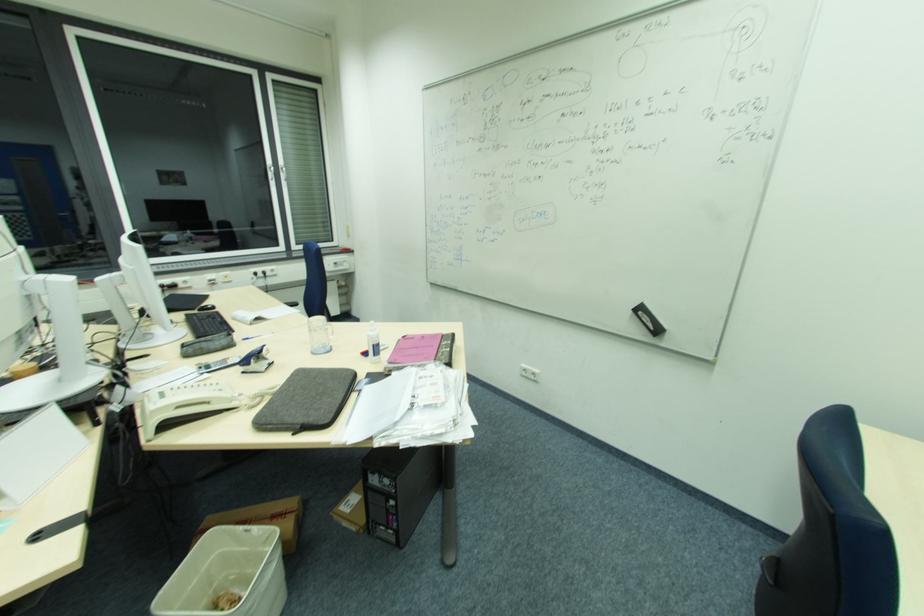
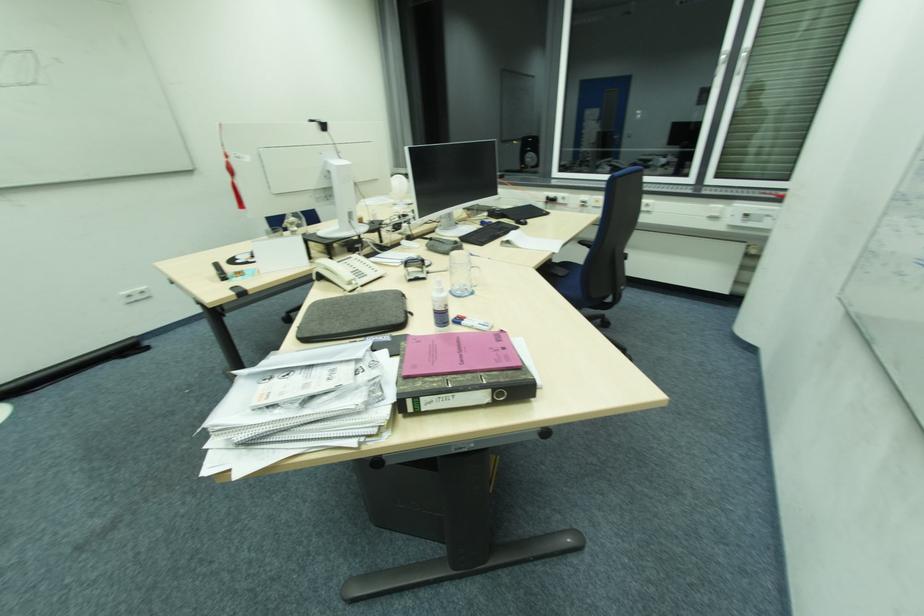
In the second image, find the point that corresponds to point 427,347 in the first image.

(465, 357)